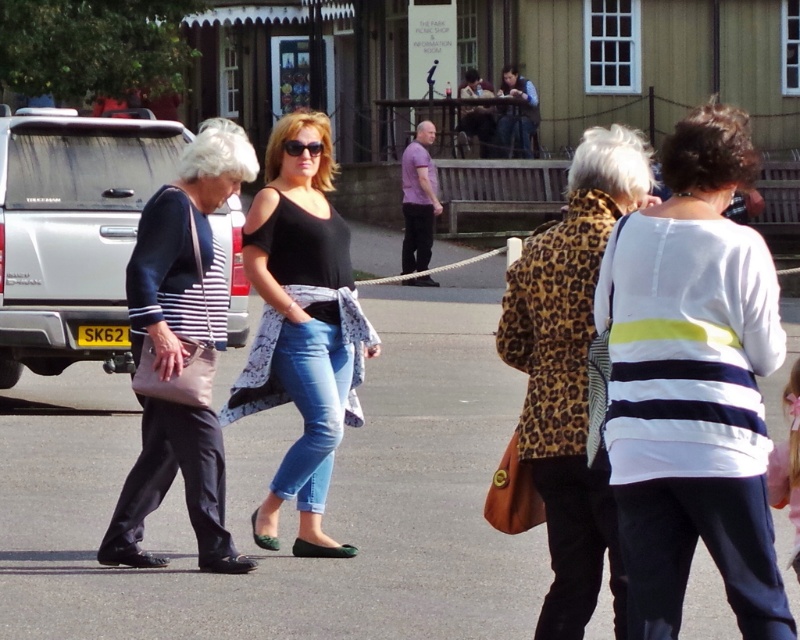
Question: Which object is the farthest from the silver metallic pickup truck at left?

Choices:
 (A) matte black jacket at left
 (B) black matte tank top at center
 (C) gray asphalt pavement at center

Answer: (B)

Question: Does white striped sweater at center have a smaller size compared to matte black jacket at left?

Choices:
 (A) no
 (B) yes

Answer: (B)

Question: Where is silver metallic pickup truck at left located in relation to black matte tank top at center in the image?

Choices:
 (A) right
 (B) left

Answer: (B)

Question: Considering the real-world distances, which object is farthest from the white striped sweater at center?

Choices:
 (A) matte black jacket at left
 (B) leopard print coat at center
 (C) gray asphalt pavement at center
 (D) black matte tank top at center

Answer: (C)

Question: Which object is the farthest from the leopard print coat at center?

Choices:
 (A) white striped sweater at center
 (B) purple matte shirt at center
 (C) matte black jacket at left
 (D) silver metallic pickup truck at left

Answer: (D)

Question: Where is white striped sweater at center located in relation to black matte tank top at center in the image?

Choices:
 (A) below
 (B) above

Answer: (A)